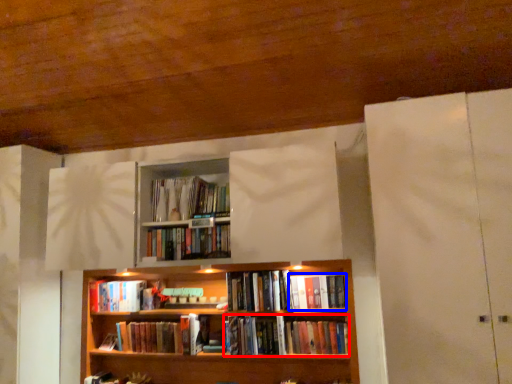
Question: Which object is closer to the camera taking this photo, book (highlighted by a red box) or book (highlighted by a blue box)?

Choices:
 (A) book
 (B) book

Answer: (A)